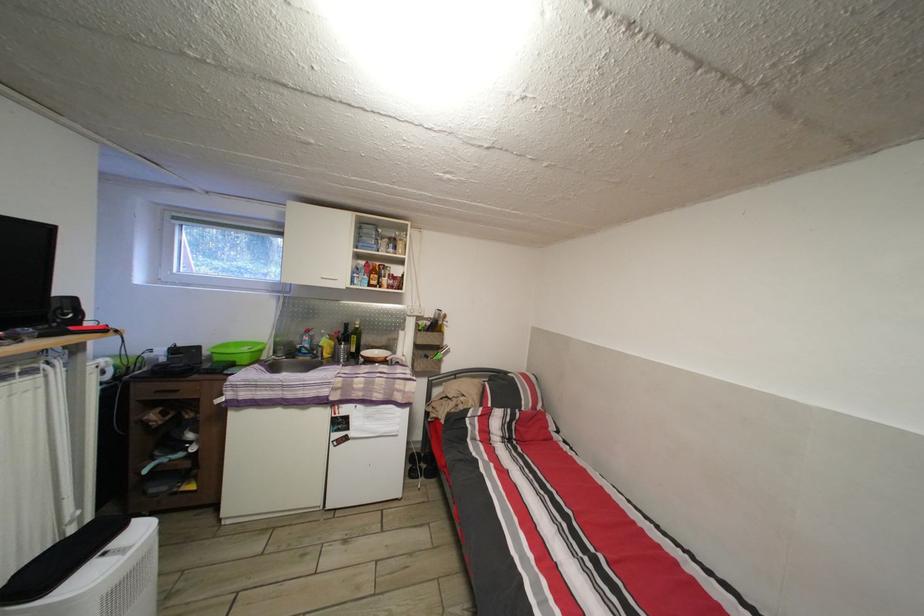
Identify the location of white cabinet handle. (332, 280).